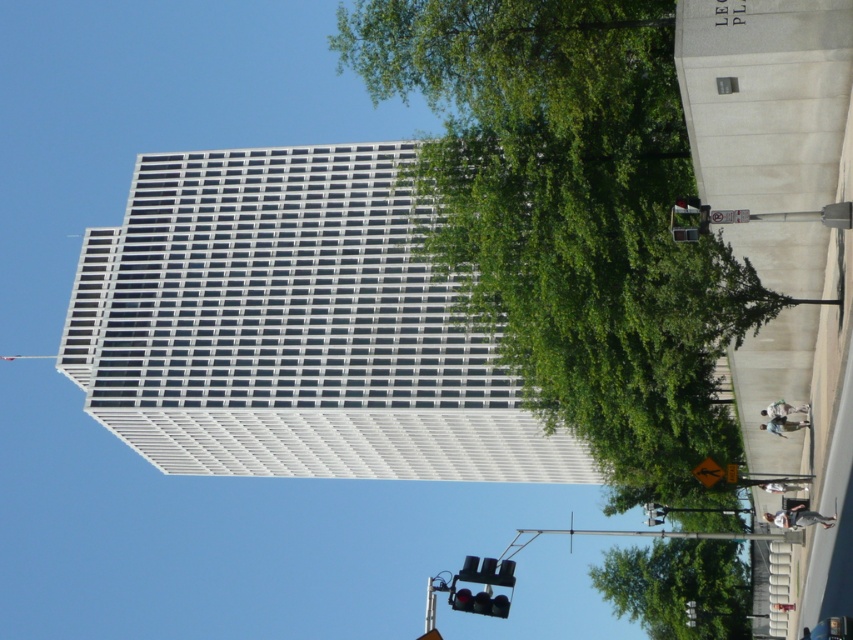
Describe the element at coordinates (677, 588) in the screenshot. I see `green leafy tree at lower center` at that location.

Is green leafy tree at lower center to the right of black glass traffic light at lower center from the viewer's perspective?

Yes, green leafy tree at lower center is to the right of black glass traffic light at lower center.

The width and height of the screenshot is (853, 640). Describe the element at coordinates (677, 588) in the screenshot. I see `green leafy tree at lower center` at that location.

Image resolution: width=853 pixels, height=640 pixels. Identify the location of green leafy tree at lower center. (677, 588).

Is green leafy tree at upper center to the left of black glass traffic light at lower center from the viewer's perspective?

Incorrect, green leafy tree at upper center is not on the left side of black glass traffic light at lower center.

Does green leafy tree at upper center have a larger size compared to black glass traffic light at lower center?

Indeed, green leafy tree at upper center has a larger size compared to black glass traffic light at lower center.

Who is more distant from viewer, (660, 67) or (498, 566)?

Positioned behind is point (660, 67).

Image resolution: width=853 pixels, height=640 pixels. I want to click on green leafy tree at upper center, so click(x=572, y=218).

Based on the photo, who is positioned more to the right, green leafy tree at upper center or green leafy tree at lower center?

green leafy tree at lower center

Can you confirm if green leafy tree at upper center is smaller than green leafy tree at lower center?

Yes.

Locate an element on the screen. The image size is (853, 640). green leafy tree at upper center is located at coordinates (572, 218).

Identify the location of green leafy tree at upper center. The width and height of the screenshot is (853, 640). (572, 218).